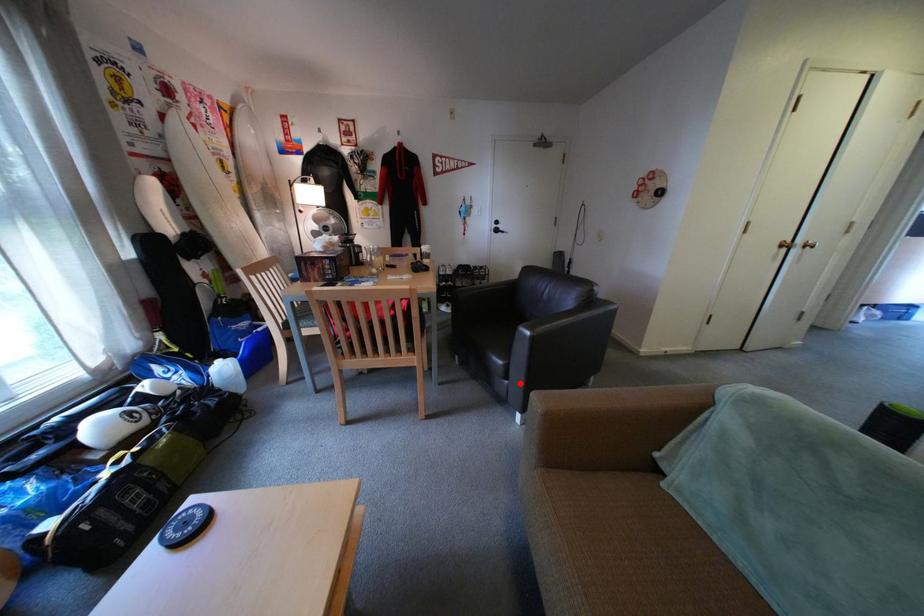
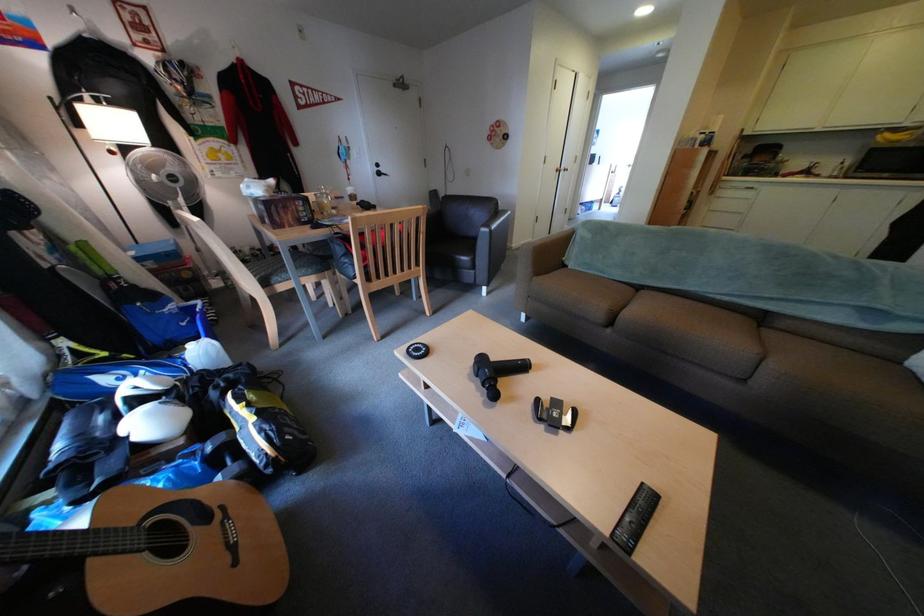
Question: I am providing you with two images of the same scene from different viewpoints. In image1, a red point is highlighted. Considering the same 3D point in image2, which of the following is correct?

Choices:
 (A) It is closer
 (B) It is farther

Answer: (A)